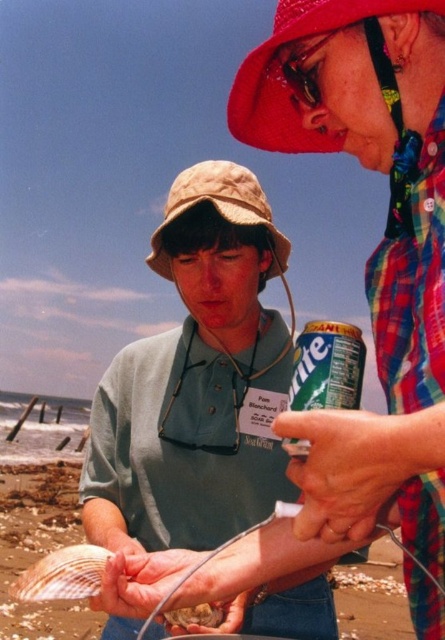
You are a marine biologist visiting the beach scene. You need to place a new research tool that is 1.2 meters tall between the shiny white shell at lower left and the fuzzy brown fur at lower center. Will the tool fit vertically between them?

The shiny white shell at lower left is taller than the fuzzy brown fur at lower center. Since the tool is 1.2 meters tall, but the height comparison between the objects doesn not provide information about the vertical space between them, it is uncertain if the tool will fit vertically. Additional measurements of the space between them are needed.

You are a photographer at the beach scene and want to capture a clear shot of both the red fabric hat at upper center and the matte plastic goggles at upper center. Given their spatial relationship, which object should you focus on first to ensure both are in frame?

The red fabric hat at upper center is much taller than the matte plastic goggles at upper center. To ensure both are in frame, focus on the taller red fabric hat first, then adjust the camera angle to include the shorter matte plastic goggles.

You are a photographer at the beach scene. You need to capture a closeup of both the plaid fabric shirt at upper right and the fuzzy brown fur at lower center in a single frame. Which object should you zoom in on first to ensure both are in focus?

You should zoom in on the plaid fabric shirt at upper right first because it is wider than the fuzzy brown fur at lower center, allowing you to frame both objects effectively.